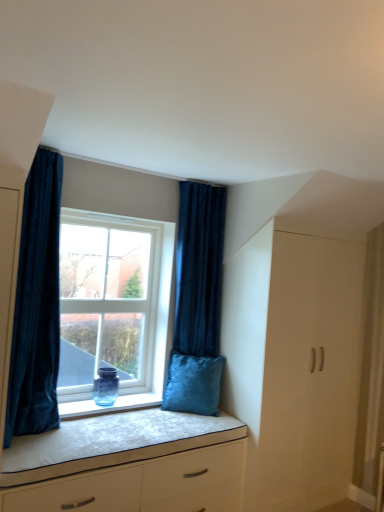
Identify the location of space that is in front of velvet dark blue curtain at left, which is the second curtain in back-to-front order. (33, 452).